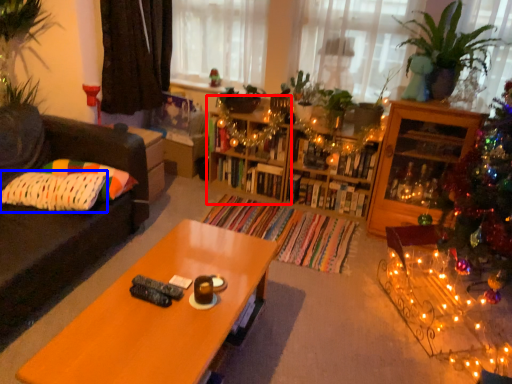
Question: Among these objects, which one is nearest to the camera, shelf (highlighted by a red box) or pillow (highlighted by a blue box)?

Choices:
 (A) shelf
 (B) pillow

Answer: (B)